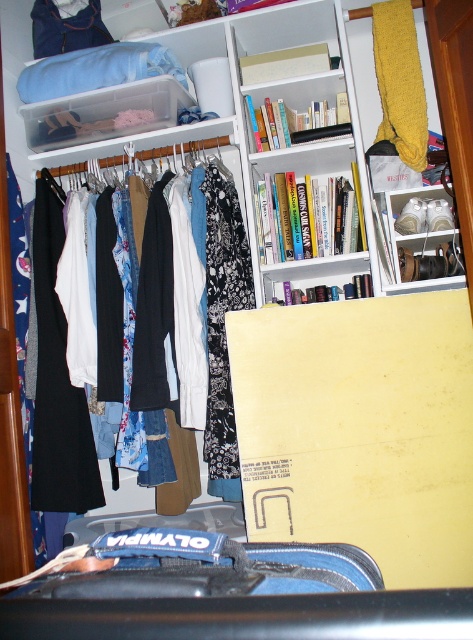
Question: Which object is positioned closest to the black floral fabric at center?

Choices:
 (A) yellow knitted scarf at upper right
 (B) white fabric hanger at center

Answer: (B)

Question: Which object is the farthest from the black floral fabric at center?

Choices:
 (A) hardcover books at upper center
 (B) white fabric hanger at center

Answer: (B)

Question: Is white plastic shoe at upper right to the right of white fabric hanger at center from the viewer's perspective?

Choices:
 (A) no
 (B) yes

Answer: (B)

Question: Which object appears farthest from the camera in this image?

Choices:
 (A) white fabric hanger at center
 (B) hardcover books at upper center

Answer: (A)

Question: Is white plastic shoe at upper right behind white fabric hanger at center?

Choices:
 (A) yes
 (B) no

Answer: (B)

Question: Where is black floral fabric at center located in relation to white fabric hanger at center in the image?

Choices:
 (A) right
 (B) left

Answer: (A)